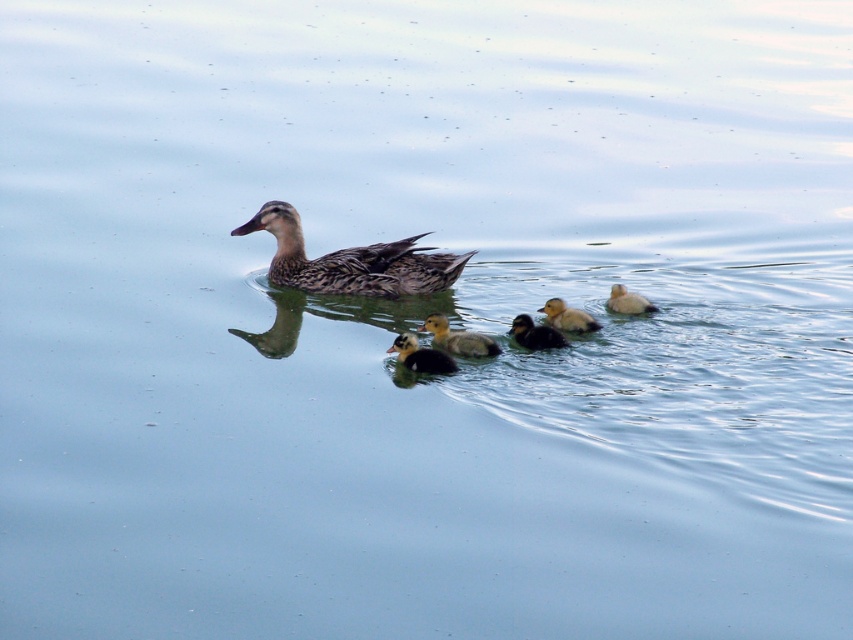
Question: Can you confirm if black fuzzy duckling at center is positioned above dark brown fuzzy duckling at center?

Choices:
 (A) no
 (B) yes

Answer: (A)

Question: Which is nearer to the yellow fluffy duckling at right?

Choices:
 (A) brown fuzzy duckling at center
 (B) dark brown fuzzy duckling at center
 (C) black fuzzy duckling at center

Answer: (B)

Question: In this image, where is black fuzzy duckling at center located relative to yellow downy duckling at center?

Choices:
 (A) left
 (B) right

Answer: (A)

Question: Which of the following is the closest to the observer?

Choices:
 (A) brown fuzzy duckling at center
 (B) brown speckled duckling at center
 (C) black fuzzy duckling at center
 (D) yellow fluffy duckling at right

Answer: (C)

Question: Estimate the real-world distances between objects in this image. Which object is farther from the brown fuzzy duckling at center?

Choices:
 (A) yellow fluffy duckling at right
 (B) dark brown fuzzy duckling at center
 (C) yellow downy duckling at center

Answer: (A)

Question: In this image, where is brown speckled duckling at center located relative to yellow fluffy duckling at right?

Choices:
 (A) below
 (B) above

Answer: (B)